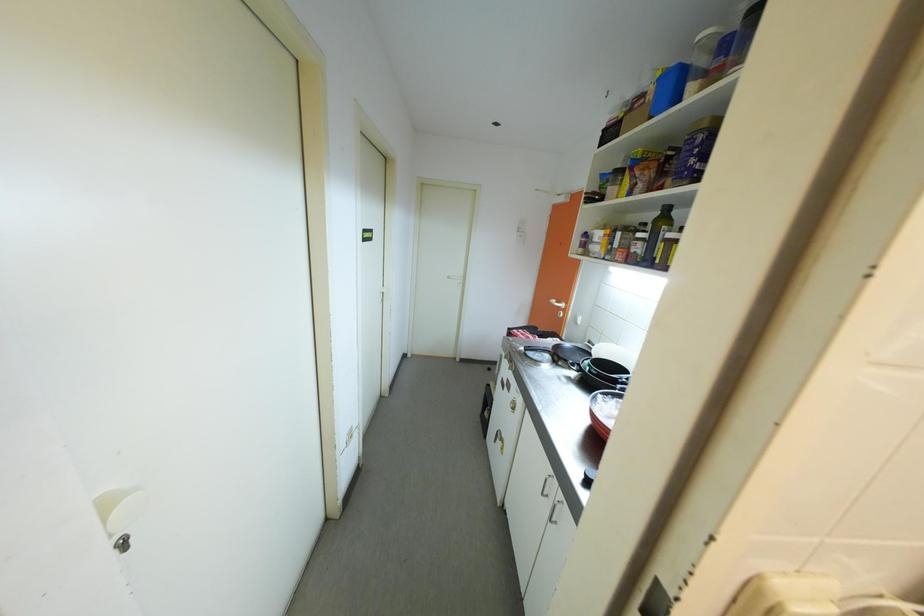
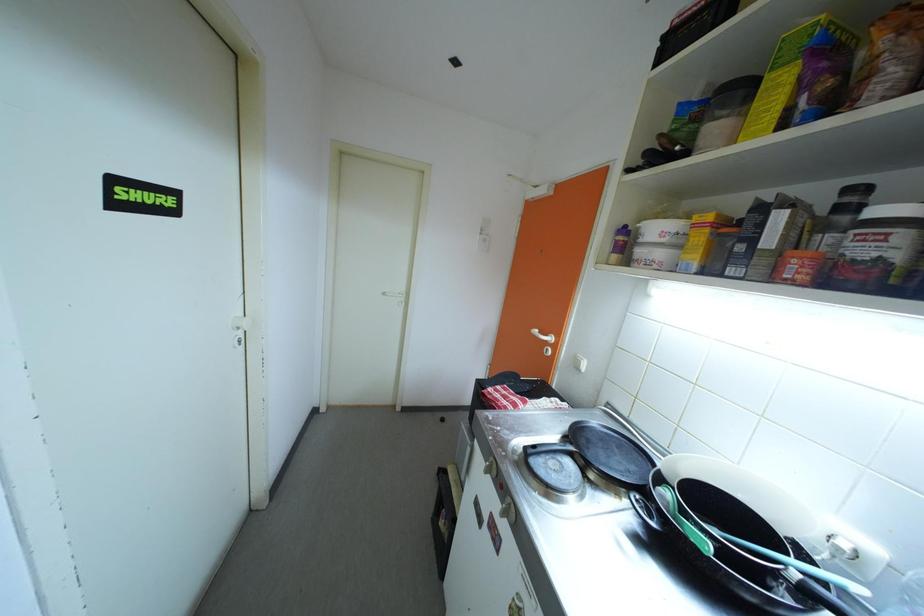
Question: The first image is from the beginning of the video and the second image is from the end. How did the camera likely rotate when shooting the video?

Choices:
 (A) Left
 (B) Right
 (C) Up
 (D) Down

Answer: (B)